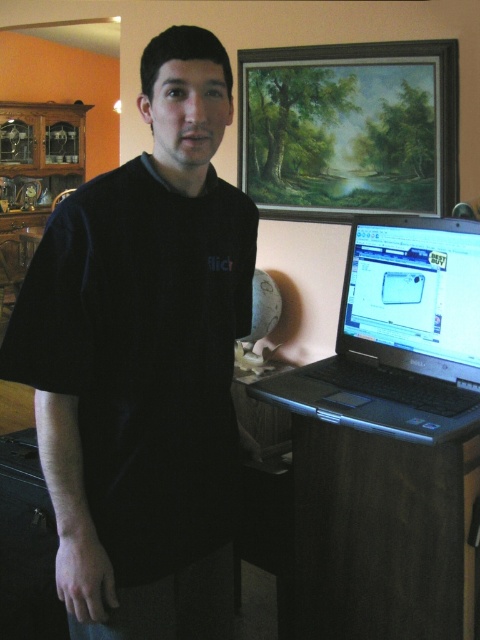
Question: Does black cotton shirt at center appear on the right side of wooden oil painting at upper center?

Choices:
 (A) no
 (B) yes

Answer: (A)

Question: In this image, where is dark wood table at lower right located relative to black plastic laptop at right?

Choices:
 (A) below
 (B) above

Answer: (A)

Question: Which point is closer to the camera?

Choices:
 (A) black cotton shirt at center
 (B) dark wood table at lower right
 (C) black plastic laptop at right
 (D) wooden oil painting at upper center

Answer: (A)

Question: Which point appears closest to the camera in this image?

Choices:
 (A) (406, 576)
 (B) (468, 323)
 (C) (269, 136)

Answer: (A)

Question: Is black cotton shirt at center wider than black plastic laptop at right?

Choices:
 (A) yes
 (B) no

Answer: (B)

Question: Which object is positioned farthest from the black plastic laptop at right?

Choices:
 (A) black cotton shirt at center
 (B) dark wood table at lower right
 (C) wooden oil painting at upper center

Answer: (C)